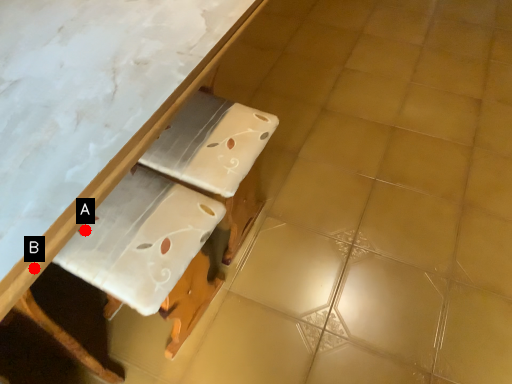
Question: Two points are circled on the image, labeled by A and B beside each circle. Among these points, which one is nearest to the camera?

Choices:
 (A) A is closer
 (B) B is closer

Answer: (B)